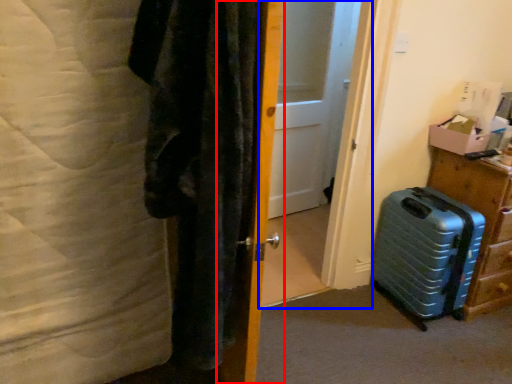
Question: Which of the following is the farthest to the observer, door (highlighted by a red box) or screen door (highlighted by a blue box)?

Choices:
 (A) door
 (B) screen door

Answer: (B)